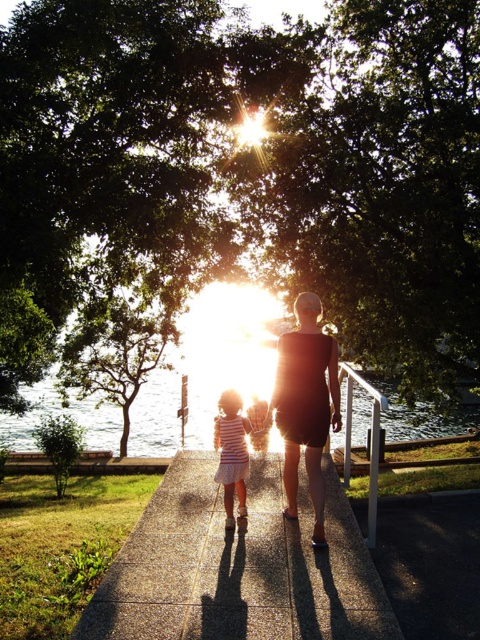
Question: Which point is farther to the camera?

Choices:
 (A) (250, 556)
 (B) (239, 426)
 (C) (286, 336)

Answer: (B)

Question: Does black matte dress at center lie in front of striped fabric dress at center?

Choices:
 (A) yes
 (B) no

Answer: (A)

Question: Which object appears closest to the camera in this image?

Choices:
 (A) black matte dress at center
 (B) striped fabric dress at center

Answer: (A)

Question: Which object appears farthest from the camera in this image?

Choices:
 (A) striped fabric dress at center
 (B) black matte dress at center

Answer: (A)

Question: Is black matte dress at center to the left of striped fabric dress at center from the viewer's perspective?

Choices:
 (A) yes
 (B) no

Answer: (B)

Question: Does concrete sidewalk at center have a greater width compared to striped fabric dress at center?

Choices:
 (A) yes
 (B) no

Answer: (A)